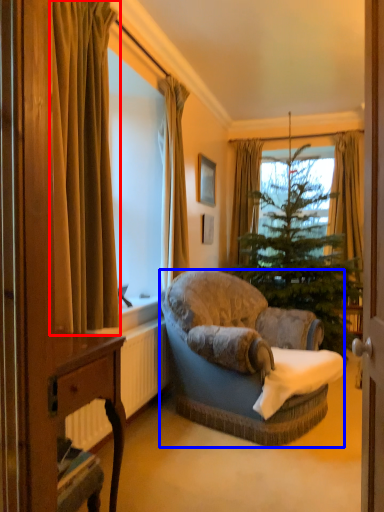
Question: Which object appears farthest to the camera in this image, curtain (highlighted by a red box) or studio couch (highlighted by a blue box)?

Choices:
 (A) curtain
 (B) studio couch

Answer: (B)